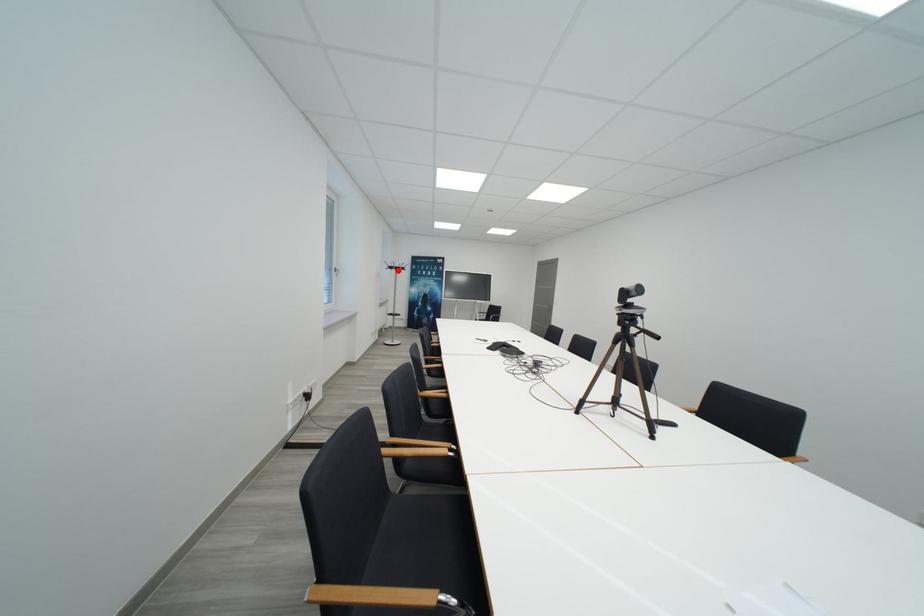
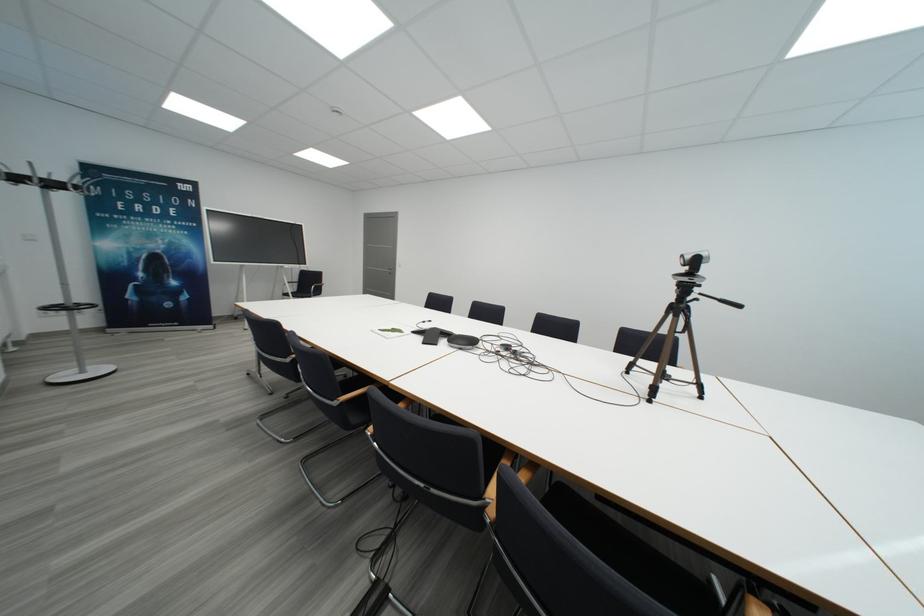
Locate, in the second image, the point that corresponds to the highlighted location in the first image.

(21, 180)